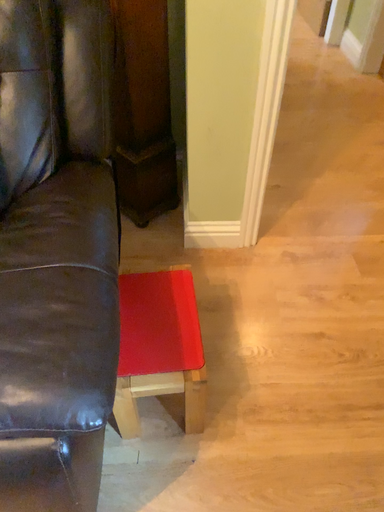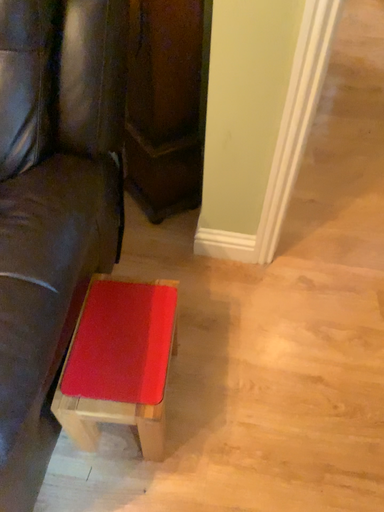
Question: Which way did the camera rotate in the video?

Choices:
 (A) rotated right
 (B) rotated left

Answer: (B)